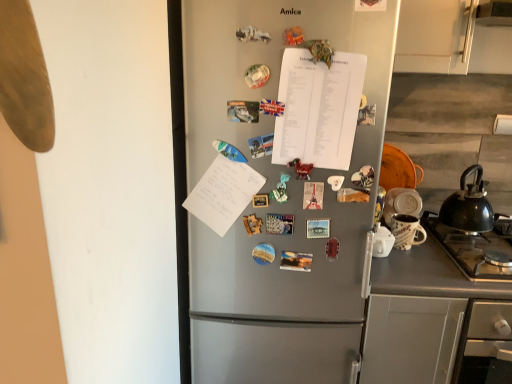
The height and width of the screenshot is (384, 512). In order to click on satin silver fridge at center in this screenshot , I will do `click(284, 190)`.

You are a GUI agent. You are given a task and a screenshot of the screen. Output one action in this format:
    pyautogui.click(x=<x>, y=<y>)
    Task: Click on the white paper at center
    
    Given the screenshot: What is the action you would take?
    pyautogui.click(x=318, y=109)

The image size is (512, 384). I want to click on black matte kettle at right, so click(x=468, y=205).

The image size is (512, 384). Find the location of `satin silver fridge at center`. satin silver fridge at center is located at coordinates (284, 190).

Looking at their sizes, would you say matte ceramic mug at right is wider or thinner than gray matte counter at lower right?

In the image, matte ceramic mug at right appears to be more narrow than gray matte counter at lower right.

Who is bigger, matte ceramic mug at right or gray matte counter at lower right?

gray matte counter at lower right is bigger.

Is matte ceramic mug at right behind gray matte counter at lower right?

Yes, it is.

Is matte ceramic mug at right in contact with gray matte counter at lower right?

No, matte ceramic mug at right is not in contact with gray matte counter at lower right.

Which is behind, satin silver fridge at center or black matte kettle at right?

black matte kettle at right is further from the camera.

Identify the location of refrigerator in front of the black matte kettle at right. The width and height of the screenshot is (512, 384). (284, 190).

Which object is positioned more to the right, satin silver fridge at center or black matte kettle at right?

black matte kettle at right is more to the right.

Can you confirm if satin silver fridge at center is smaller than black matte kettle at right?

Actually, satin silver fridge at center might be larger than black matte kettle at right.

Is matte ceramic mug at right turned away from satin silver fridge at center?

That's not correct — matte ceramic mug at right is not looking away from satin silver fridge at center.

Which object is wider, matte ceramic mug at right or satin silver fridge at center?

With larger width is satin silver fridge at center.

In terms of height, does matte ceramic mug at right look taller or shorter compared to satin silver fridge at center?

matte ceramic mug at right is shorter than satin silver fridge at center.

What are the coordinates of `notebook behind the satin silver fridge at center` in the screenshot? It's located at (318, 109).

Which of these two, satin silver fridge at center or white paper at center, stands taller?

Standing taller between the two is satin silver fridge at center.

From the image's perspective, is satin silver fridge at center above or below white paper at center?

Based on their image positions, satin silver fridge at center is located beneath white paper at center.

Does black matte kettle at right have a greater width compared to matte ceramic mug at right?

Yes.

Is black matte kettle at right oriented away from matte ceramic mug at right?

No.

Can you see black matte kettle at right touching matte ceramic mug at right?

They are not placed beside each other.

How different are the orientations of satin silver fridge at center and gray matte counter at lower right in degrees?

satin silver fridge at center and gray matte counter at lower right are facing 4.76e-05 degrees away from each other.

Does satin silver fridge at center touch gray matte counter at lower right?

No, satin silver fridge at center is not next to gray matte counter at lower right.

Is satin silver fridge at center inside the boundaries of gray matte counter at lower right, or outside?

satin silver fridge at center lies outside gray matte counter at lower right.

In terms of width, does satin silver fridge at center look wider or thinner when compared to gray matte counter at lower right?

In the image, satin silver fridge at center appears to be more narrow than gray matte counter at lower right.

Does satin silver fridge at center appear on the left side of matte ceramic mug at right?

Indeed, satin silver fridge at center is positioned on the left side of matte ceramic mug at right.

Based on the photo, which is closer, [283,222] or [422,241]?

Point [283,222]

Considering the sizes of objects satin silver fridge at center and matte ceramic mug at right in the image provided, who is taller, satin silver fridge at center or matte ceramic mug at right?

satin silver fridge at center.

At what (x,y) coordinates should I click in order to perform the action: click on counter located below the matte ceramic mug at right (from the image's perspective). Please return your answer as a coordinate pair (x, y). The image size is (512, 384). Looking at the image, I should click on click(x=436, y=311).

Image resolution: width=512 pixels, height=384 pixels. Identify the location of refrigerator on the left of black matte kettle at right. (284, 190).

From the image, which object appears to be nearer to black matte kettle at right, gray matte counter at lower right or white paper at center?

The object closer to black matte kettle at right is gray matte counter at lower right.

Estimate the real-world distances between objects in this image. Which object is further from gray matte counter at lower right, satin silver fridge at center or white paper at center?

white paper at center lies further to gray matte counter at lower right than the other object.

Looking at this image, estimate the real-world distances between objects in this image. Which object is further from gray matte counter at lower right, matte ceramic mug at right or satin silver fridge at center?

Based on the image, satin silver fridge at center appears to be further to gray matte counter at lower right.

Considering their positions, is white paper at center positioned further to matte ceramic mug at right than black matte kettle at right?

white paper at center.

Which object lies nearer to the anchor point white paper at center, black matte kettle at right or matte ceramic mug at right?

matte ceramic mug at right is positioned closer to the anchor white paper at center.

Looking at the image, which one is located further to black matte kettle at right, gray matte counter at lower right or satin silver fridge at center?

satin silver fridge at center is further to black matte kettle at right.

Based on their spatial positions, is gray matte counter at lower right or matte ceramic mug at right further from white paper at center?

gray matte counter at lower right is positioned further to the anchor white paper at center.

Considering their positions, is black matte kettle at right positioned further to satin silver fridge at center than gray matte counter at lower right?

black matte kettle at right lies further to satin silver fridge at center than the other object.

Where is `counter between satin silver fridge at center and black matte kettle at right`? The height and width of the screenshot is (384, 512). counter between satin silver fridge at center and black matte kettle at right is located at coordinates (436, 311).

This screenshot has width=512, height=384. I want to click on appliance that lies between black matte kettle at right and gray matte counter at lower right from top to bottom, so click(x=407, y=231).

Locate an element on the screen. counter between satin silver fridge at center and matte ceramic mug at right from left to right is located at coordinates (436, 311).

Find the location of `notebook between satin silver fridge at center and matte ceramic mug at right from front to back`. notebook between satin silver fridge at center and matte ceramic mug at right from front to back is located at coordinates (318, 109).